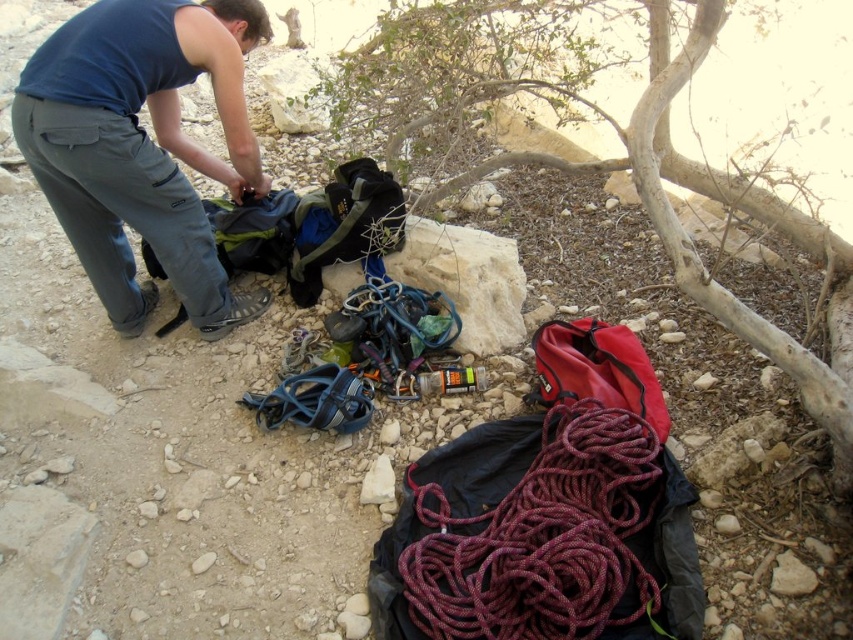
You are a hiker preparing to pack your gear. You see the blue fabric pants at left and the maroon braided rope at center. Which item takes up more space in your backpack?

The blue fabric pants at left is larger in size than the maroon braided rope at center, so it takes up more space in the backpack.